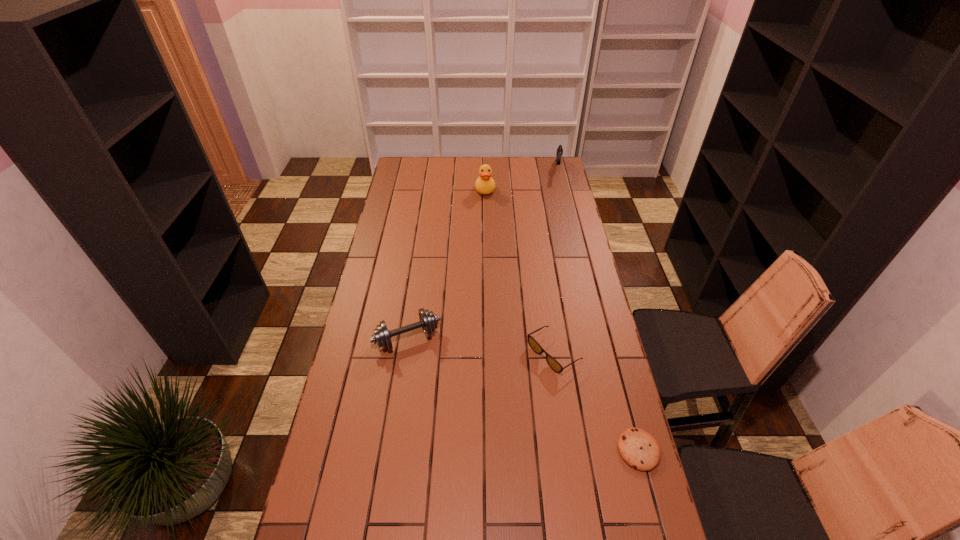
The image size is (960, 540). What are the coordinates of `free space between the duck and the third tallest object` in the screenshot? It's located at (446, 264).

Locate an element on the screen. This screenshot has width=960, height=540. free space between the dumbbell and the sunglasses is located at coordinates (481, 346).

This screenshot has height=540, width=960. Find the location of `object that stands as the closest to the farthest object`. object that stands as the closest to the farthest object is located at coordinates (484, 184).

Identify which object is the second closest to the nearest object. Please provide its 2D coordinates. Your answer should be formatted as a tuple, i.e. [(x, y)], where the tuple contains the x and y coordinates of a point satisfying the conditions above.

[(428, 321)]

Find the location of a particular element. Image resolution: width=960 pixels, height=540 pixels. free location that satisfies the following two spatial constraints: 1. on the back side of the farthest object; 2. on the right side of the tallest object is located at coordinates (485, 169).

This screenshot has width=960, height=540. I want to click on vacant point that satisfies the following two spatial constraints: 1. on the back side of the duck; 2. on the left side of the farthest object, so click(x=485, y=169).

The height and width of the screenshot is (540, 960). I want to click on free space that satisfies the following two spatial constraints: 1. on the front side of the fourth tallest object; 2. on the left side of the shortest object, so click(x=567, y=450).

I want to click on free space that satisfies the following two spatial constraints: 1. on the back side of the leftmost object; 2. on the left side of the farthest object, so click(x=433, y=169).